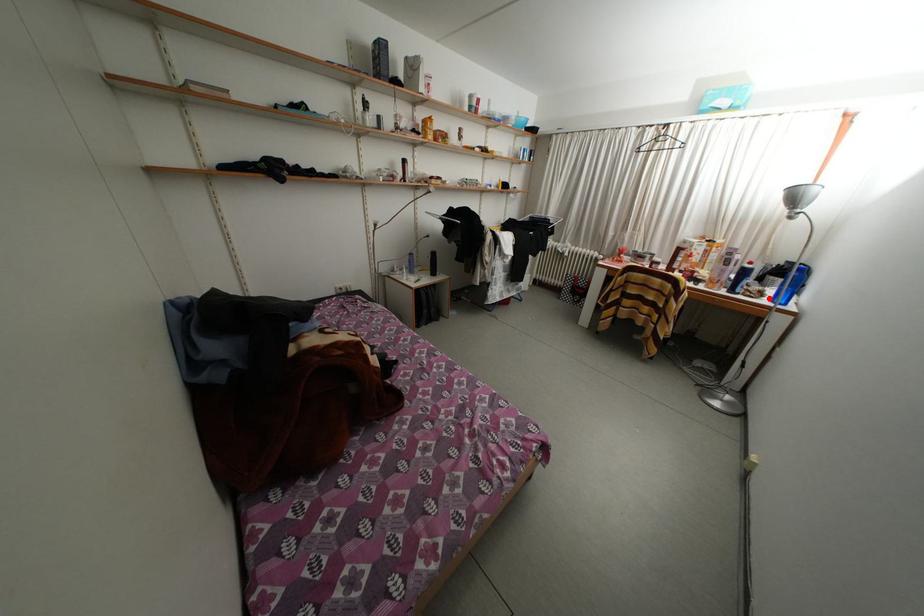
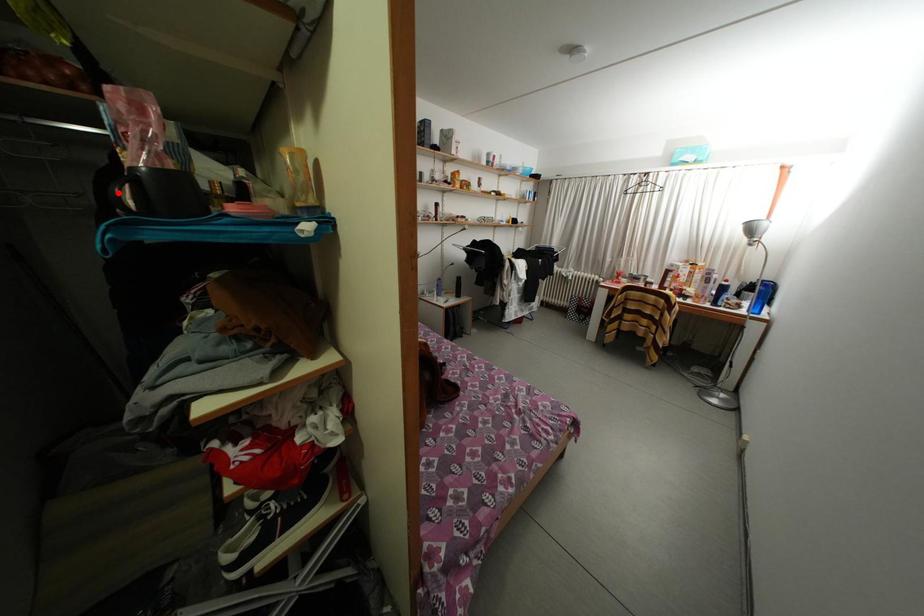
I am providing you with two images of the same scene from different viewpoints. A red point is marked on the first image and another point is marked on the second image. Is the red point in image1 aligned with the point shown in image2?

No